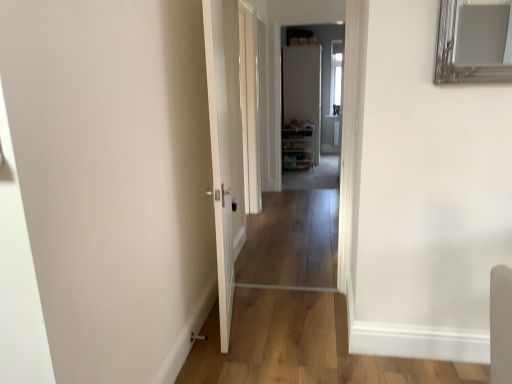
Identify the location of free space to the right of white glossy door at center, the first door viewed from the front. (284, 325).